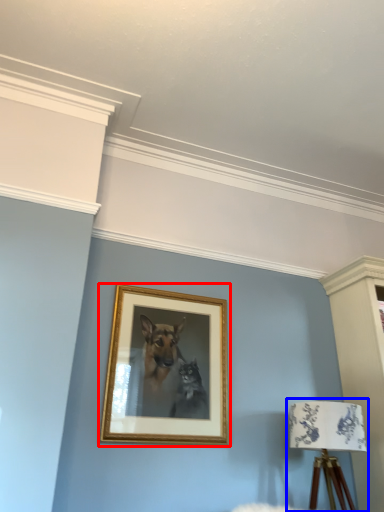
Question: Which of the following is the closest to the observer, picture frame (highlighted by a red box) or table lamp (highlighted by a blue box)?

Choices:
 (A) picture frame
 (B) table lamp

Answer: (B)